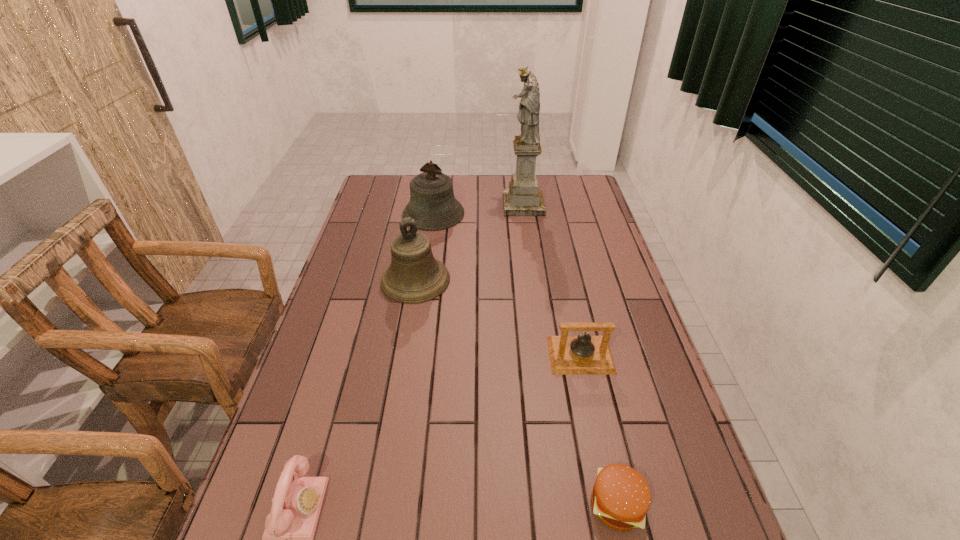
I want to click on bell that is the second nearest to the hamburger, so click(414, 276).

Image resolution: width=960 pixels, height=540 pixels. What are the coordinates of `free location that satisfies the following two spatial constraints: 1. on the front-facing side of the tallest object; 2. on the back side of the rightmost bell` in the screenshot? It's located at (544, 355).

Locate an element on the screen. free space that satisfies the following two spatial constraints: 1. on the front-facing side of the tallest object; 2. on the left side of the nearest bell is located at coordinates (544, 355).

Locate an element on the screen. This screenshot has width=960, height=540. vacant area in the image that satisfies the following two spatial constraints: 1. on the front-facing side of the sculpture; 2. on the front side of the farthest bell is located at coordinates (524, 214).

You are a GUI agent. You are given a task and a screenshot of the screen. Output one action in this format:
    pyautogui.click(x=<x>, y=<y>)
    Task: Click on the free space that satisfies the following two spatial constraints: 1. on the front-facing side of the sculpture; 2. on the right side of the rightmost bell
    The image size is (960, 540).
    Given the screenshot: What is the action you would take?
    pyautogui.click(x=544, y=355)

I want to click on free space that satisfies the following two spatial constraints: 1. on the front side of the hamburger; 2. on the left side of the farthest bell, so click(x=392, y=505).

Image resolution: width=960 pixels, height=540 pixels. In order to click on vacant space that satisfies the following two spatial constraints: 1. on the front-facing side of the sculpture; 2. on the right side of the shortest object in this screenshot , I will do `click(564, 505)`.